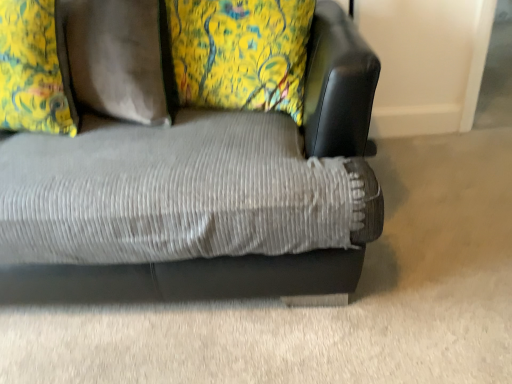
Question: Is the position of black leather swivel chair at upper right more distant than that of corduroy fabric couch at center?

Choices:
 (A) no
 (B) yes

Answer: (B)

Question: Would you say black leather swivel chair at upper right is a long distance from corduroy fabric couch at center?

Choices:
 (A) no
 (B) yes

Answer: (A)

Question: Can you confirm if black leather swivel chair at upper right is bigger than corduroy fabric couch at center?

Choices:
 (A) no
 (B) yes

Answer: (A)

Question: Is black leather swivel chair at upper right at the left side of corduroy fabric couch at center?

Choices:
 (A) yes
 (B) no

Answer: (B)

Question: Considering the relative sizes of black leather swivel chair at upper right and corduroy fabric couch at center in the image provided, is black leather swivel chair at upper right wider than corduroy fabric couch at center?

Choices:
 (A) yes
 (B) no

Answer: (B)

Question: From a real-world perspective, is black leather swivel chair at upper right physically located above or below floral fabric pillow at upper left?

Choices:
 (A) above
 (B) below

Answer: (B)

Question: Looking at the image, does black leather swivel chair at upper right seem bigger or smaller compared to floral fabric pillow at upper left?

Choices:
 (A) small
 (B) big

Answer: (A)

Question: Visually, is black leather swivel chair at upper right positioned to the left or to the right of floral fabric pillow at upper left?

Choices:
 (A) left
 (B) right

Answer: (B)

Question: Choose the correct answer: Is black leather swivel chair at upper right inside floral fabric pillow at upper left or outside it?

Choices:
 (A) inside
 (B) outside

Answer: (B)

Question: From a real-world perspective, is black leather swivel chair at upper right above or below corduroy fabric couch at center?

Choices:
 (A) below
 (B) above

Answer: (B)

Question: Considering the relative positions of black leather swivel chair at upper right and corduroy fabric couch at center in the image provided, is black leather swivel chair at upper right to the left or to the right of corduroy fabric couch at center?

Choices:
 (A) left
 (B) right

Answer: (B)

Question: Is black leather swivel chair at upper right taller or shorter than corduroy fabric couch at center?

Choices:
 (A) tall
 (B) short

Answer: (B)

Question: Is black leather swivel chair at upper right in front of or behind corduroy fabric couch at center in the image?

Choices:
 (A) front
 (B) behind

Answer: (B)

Question: From a real-world perspective, is floral fabric pillow at upper left positioned above or below black leather swivel chair at upper right?

Choices:
 (A) above
 (B) below

Answer: (A)

Question: From the image's perspective, is floral fabric pillow at upper left positioned above or below black leather swivel chair at upper right?

Choices:
 (A) below
 (B) above

Answer: (A)